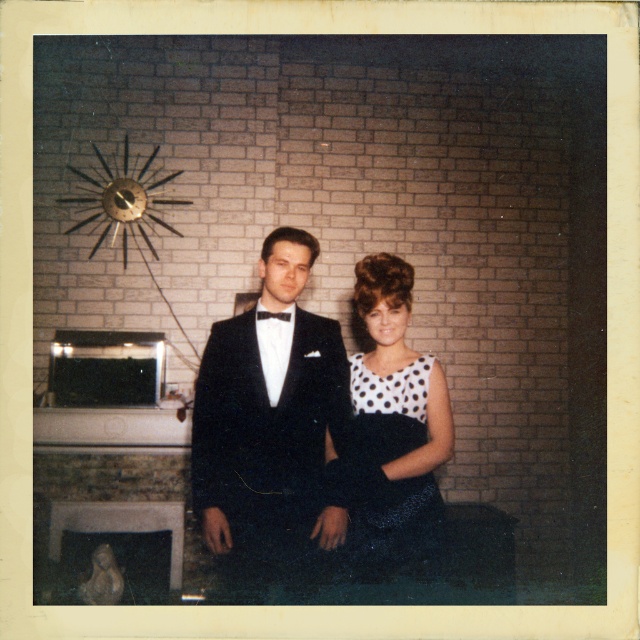
Question: Which of the following is the farthest from the observer?

Choices:
 (A) (397, 332)
 (B) (259, 314)

Answer: (B)

Question: Is black satin tuxedo at center wider than black satin bow tie at center?

Choices:
 (A) yes
 (B) no

Answer: (A)

Question: Estimate the real-world distances between objects in this image. Which object is farther from the black satin tuxedo at center?

Choices:
 (A) black satin bow tie at center
 (B) white dotted dress at center

Answer: (A)

Question: Is black satin tuxedo at center closer to the viewer compared to white dotted dress at center?

Choices:
 (A) no
 (B) yes

Answer: (A)

Question: Does black satin tuxedo at center lie behind white dotted dress at center?

Choices:
 (A) no
 (B) yes

Answer: (B)

Question: Estimate the real-world distances between objects in this image. Which object is farther from the white dotted dress at center?

Choices:
 (A) black satin tuxedo at center
 (B) black satin bow tie at center

Answer: (B)